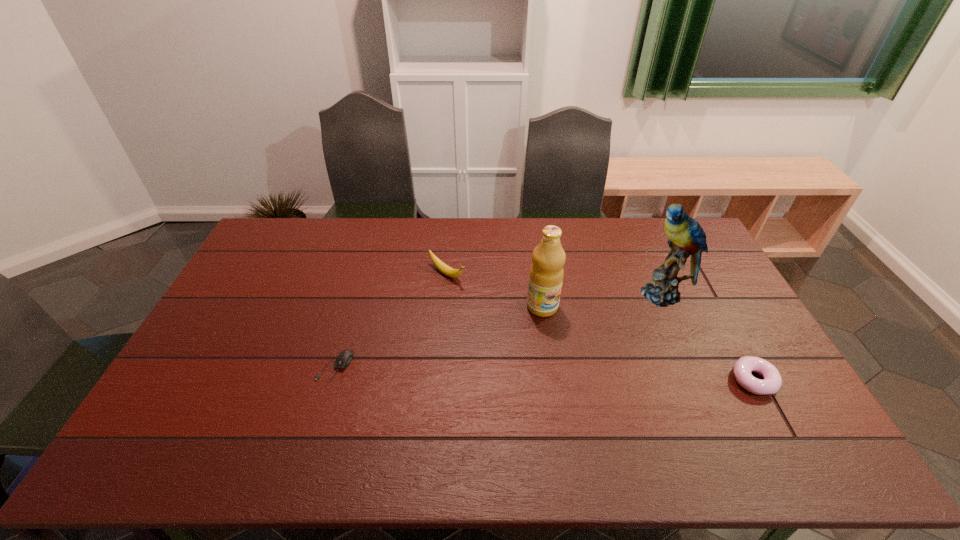
I want to click on free space located 0.340m on the face of the tallest object, so click(578, 357).

What are the coordinates of `vacant area located on the face of the tallest object` in the screenshot? It's located at (608, 333).

Find the location of a particular element. vacant space located 0.360m on the face of the tallest object is located at coordinates (573, 361).

Locate an element on the screen. This screenshot has width=960, height=540. vacant space located 0.240m at the stem of the second object from left to right is located at coordinates (514, 319).

Find the location of a particular element. free space located 0.340m at the stem of the second object from left to right is located at coordinates (540, 336).

Where is `free space located 0.170m at the stem of the second object from left to right`? The width and height of the screenshot is (960, 540). free space located 0.170m at the stem of the second object from left to right is located at coordinates (497, 308).

Locate an element on the screen. blank area located on the label of the third object from right to left is located at coordinates (631, 421).

Where is `free region located 0.210m on the label of the third object from right to left`? This screenshot has height=540, width=960. free region located 0.210m on the label of the third object from right to left is located at coordinates (589, 367).

You are a GUI agent. You are given a task and a screenshot of the screen. Output one action in this format:
    pyautogui.click(x=<x>, y=<y>)
    Task: Click on the vacant space situated 0.220m on the label of the third object from right to left
    
    Given the screenshot: What is the action you would take?
    pyautogui.click(x=591, y=370)

Image resolution: width=960 pixels, height=540 pixels. I want to click on object at the near edge, so click(x=742, y=369).